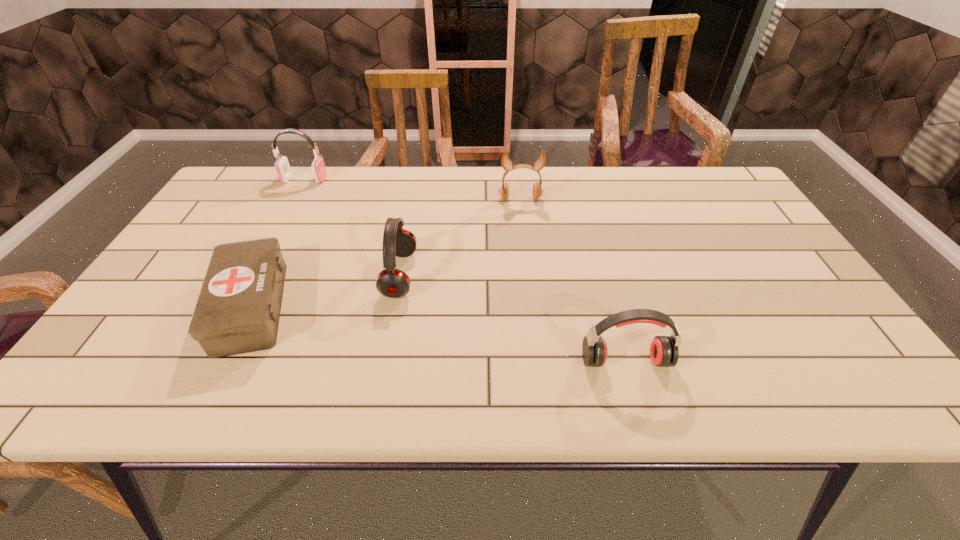
The width and height of the screenshot is (960, 540). Find the location of `free space between the nearest earphone and the third earphone from left to right`. free space between the nearest earphone and the third earphone from left to right is located at coordinates (573, 280).

You are a GUI agent. You are given a task and a screenshot of the screen. Output one action in this format:
    pyautogui.click(x=<x>, y=<y>)
    Task: Click on the unoccupied position between the second nearest earphone and the third nearest earphone
    The width and height of the screenshot is (960, 540).
    Given the screenshot: What is the action you would take?
    pos(460,237)

The height and width of the screenshot is (540, 960). Identify the location of vacant space in between the fourth nearest object and the nearest earphone. (573, 280).

This screenshot has width=960, height=540. I want to click on vacant space that's between the shortest object and the rightmost earphone, so click(x=438, y=334).

The height and width of the screenshot is (540, 960). What are the coordinates of `free spot between the farthest object and the fourth nearest object` in the screenshot? It's located at (413, 189).

Locate an element on the screen. free space between the rightmost earphone and the first-aid kit is located at coordinates (438, 334).

Where is `vacant space that's between the rightmost object and the first-aid kit`? This screenshot has width=960, height=540. vacant space that's between the rightmost object and the first-aid kit is located at coordinates coord(438,334).

You are a GUI agent. You are given a task and a screenshot of the screen. Output one action in this format:
    pyautogui.click(x=<x>, y=<y>)
    Task: Click on the unoccupied area between the nearest earphone and the farthest object
    The height and width of the screenshot is (540, 960).
    Given the screenshot: What is the action you would take?
    pyautogui.click(x=465, y=270)

Identify the location of object that is the third closest to the third object from right to left. The height and width of the screenshot is (540, 960). (664, 352).

At what (x,y) coordinates should I click in order to perform the action: click on object that ranks as the third closest to the farthest earphone. Please return your answer as a coordinate pair (x, y). Image resolution: width=960 pixels, height=540 pixels. Looking at the image, I should click on (506, 162).